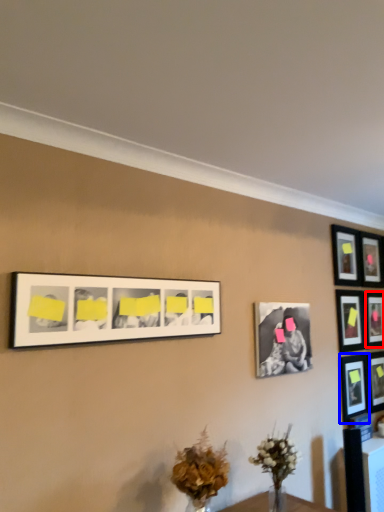
Question: Which object appears farthest to the camera in this image, picture frame (highlighted by a red box) or picture frame (highlighted by a blue box)?

Choices:
 (A) picture frame
 (B) picture frame

Answer: (A)